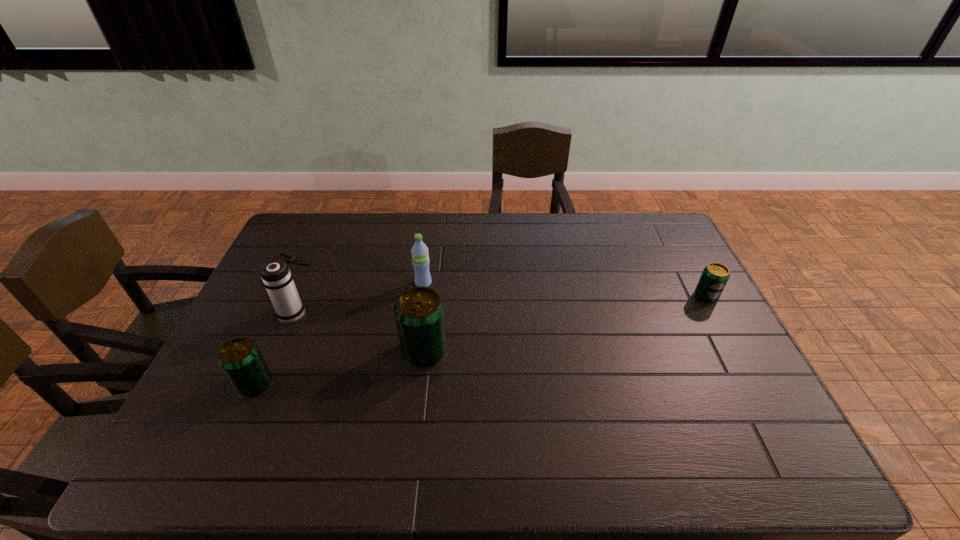
Where is `vacant space located on the front of the tallest beer can`? Image resolution: width=960 pixels, height=540 pixels. vacant space located on the front of the tallest beer can is located at coordinates (417, 421).

At what (x,y) coordinates should I click in order to perform the action: click on vacant space situated 0.080m on the back of the fifth tallest object. Please return your answer as a coordinate pair (x, y). This screenshot has height=540, width=960. Looking at the image, I should click on (693, 272).

Find the location of `vacant region located on the front of the pliers`. vacant region located on the front of the pliers is located at coordinates (280, 288).

Identify the location of vacant space situated on the right of the water bottle. The height and width of the screenshot is (540, 960). (552, 284).

This screenshot has height=540, width=960. Find the location of `vacant space situated on the side with the handle of the thermos bottle`. vacant space situated on the side with the handle of the thermos bottle is located at coordinates (312, 270).

Where is `vacant space located 0.070m on the side with the handle of the thermos bottle`? vacant space located 0.070m on the side with the handle of the thermos bottle is located at coordinates (304, 286).

Where is `vacant position located on the side with the handle of the thermos bottle`? vacant position located on the side with the handle of the thermos bottle is located at coordinates (324, 242).

The image size is (960, 540). Find the location of `object at the near edge`. object at the near edge is located at coordinates (241, 360).

At what (x,y) coordinates should I click in order to perform the action: click on beer can that is at the left edge. Please return your answer as a coordinate pair (x, y). Looking at the image, I should click on (241, 360).

Where is `pliers present at the left edge`? pliers present at the left edge is located at coordinates (295, 260).